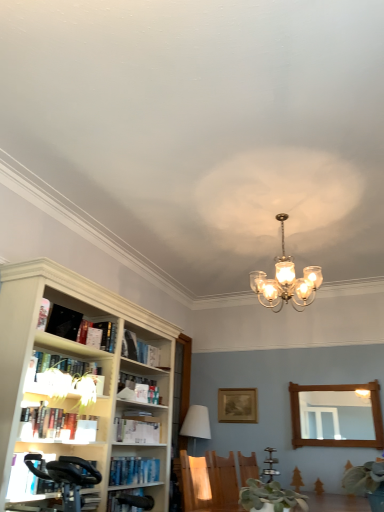
Describe the element at coordinates (101, 334) in the screenshot. This screenshot has height=512, width=384. I see `hardcover book at left, arranged as the seventh book when ordered from the bottom` at that location.

The height and width of the screenshot is (512, 384). What are the coordinates of `wooden mirror at right` in the screenshot? It's located at (336, 416).

At what (x,y) coordinates should I click in order to perform the action: click on white paper book at left, marked as the third book in a bottom-to-top arrangement. Please return your answer as a coordinate pair (x, y). The height and width of the screenshot is (512, 384). Looking at the image, I should click on (137, 431).

Measure the distance between blue hardcover book at lower left, the tenth book when ordered from top to bottom, and camera.

10.93 feet.

You are a GUI agent. You are given a task and a screenshot of the screen. Output one action in this format:
    pyautogui.click(x=<x>, y=<y>)
    Task: Click on the blue hardcover book at lower left, the 1th book when ordered from bottom to top
    Image resolution: width=384 pixels, height=512 pixels.
    Given the screenshot: What is the action you would take?
    pyautogui.click(x=133, y=470)

Measure the distance between point (207, 434) and camera.

They are 4.75 meters apart.

This screenshot has width=384, height=512. I want to click on white fabric lampshade at center, which is the 2th lamp from front to back, so click(196, 424).

What do you see at coordinates (63, 322) in the screenshot? I see `black matte bookshelf at upper left, acting as the second book starting from the top` at bounding box center [63, 322].

The width and height of the screenshot is (384, 512). In order to click on hardcover book at lower left, positioned as the 2th book in bottom-to-top order in this screenshot , I will do `click(75, 501)`.

Locate an element on the screen. The image size is (384, 512). black leather swivel chair at lower left is located at coordinates (67, 477).

The image size is (384, 512). I want to click on hardcover book at left, arranged as the seventh book when ordered from the bottom, so click(101, 334).

Is hardcover book at left, which ranks as the 7th book in top-to-bottom order, positioned beyond the bounds of black matte bookshelf at upper left, the ninth book in the bottom-to-top sequence?

Yes, hardcover book at left, which ranks as the 7th book in top-to-bottom order, is not within black matte bookshelf at upper left, the ninth book in the bottom-to-top sequence.

From the image's perspective, which book is the 5th one above the hardcover book at left, which is the fourth book in bottom-to-top order? Please provide its 2D coordinates.

[(63, 322)]

What's the angular difference between hardcover book at left, which ranks as the 7th book in top-to-bottom order, and black matte bookshelf at upper left, the ninth book in the bottom-to-top sequence,'s facing directions?

There is a 5.68-degree angle between the facing directions of hardcover book at left, which ranks as the 7th book in top-to-bottom order, and black matte bookshelf at upper left, the ninth book in the bottom-to-top sequence.

How much distance is there between hardcover book at left, which ranks as the 7th book in top-to-bottom order, and black matte bookshelf at upper left, the ninth book in the bottom-to-top sequence?

They are 24.04 inches apart.

Considering the relative sizes of hardcover book at left, placed as the 8th book when sorted from bottom to top, and white paper book at left, which is the 8th book in top-to-bottom order, in the image provided, is hardcover book at left, placed as the 8th book when sorted from bottom to top, wider than white paper book at left, which is the 8th book in top-to-bottom order,?

In fact, hardcover book at left, placed as the 8th book when sorted from bottom to top, might be narrower than white paper book at left, which is the 8th book in top-to-bottom order.

Which object is positioned more to the right, hardcover book at left, placed as the 8th book when sorted from bottom to top, or white paper book at left, which is the 8th book in top-to-bottom order?

From the viewer's perspective, white paper book at left, which is the 8th book in top-to-bottom order, appears more on the right side.

Does hardcover book at left, positioned as the 3th book in top-to-bottom order, have a smaller size compared to white paper book at left, marked as the third book in a bottom-to-top arrangement?

Correct, hardcover book at left, positioned as the 3th book in top-to-bottom order, occupies less space than white paper book at left, marked as the third book in a bottom-to-top arrangement.

From the image's perspective, is hardcover book at left, positioned as the 3th book in top-to-bottom order, located above or below white paper book at left, which is the 8th book in top-to-bottom order?

hardcover book at left, positioned as the 3th book in top-to-bottom order, is situated higher than white paper book at left, which is the 8th book in top-to-bottom order, in the image.

Considering the sizes of objects blue hardcover book at lower left, the 1th book when ordered from bottom to top, and black leather swivel chair at lower left in the image provided, who is bigger, blue hardcover book at lower left, the 1th book when ordered from bottom to top, or black leather swivel chair at lower left?

black leather swivel chair at lower left.

Would you say blue hardcover book at lower left, the 1th book when ordered from bottom to top, is inside or outside black leather swivel chair at lower left?

blue hardcover book at lower left, the 1th book when ordered from bottom to top, cannot be found inside black leather swivel chair at lower left.

Is blue hardcover book at lower left, the 1th book when ordered from bottom to top, taller or shorter than black leather swivel chair at lower left?

Clearly, blue hardcover book at lower left, the 1th book when ordered from bottom to top, is shorter compared to black leather swivel chair at lower left.

Which is farther, (53, 333) or (151, 435)?

The point (151, 435) is farther from the camera.

Is the depth of black matte bookshelf at upper left, the ninth book in the bottom-to-top sequence, greater than that of white paper book at left, which is the 8th book in top-to-bottom order?

No, the depth of black matte bookshelf at upper left, the ninth book in the bottom-to-top sequence, is less than that of white paper book at left, which is the 8th book in top-to-bottom order.

Based on the photo, does black matte bookshelf at upper left, acting as the second book starting from the top, have a greater height compared to white paper book at left, marked as the third book in a bottom-to-top arrangement?

Yes, black matte bookshelf at upper left, acting as the second book starting from the top, is taller than white paper book at left, marked as the third book in a bottom-to-top arrangement.

Is white paper book at left, marked as the third book in a bottom-to-top arrangement, located within black matte bookshelf at upper left, acting as the second book starting from the top?

No.

Choose the correct answer: Is hardcover book at left, which is the fourth book in bottom-to-top order, inside hardcover book at center, which is counted as the 5th book, starting from the bottom, or outside it?

hardcover book at left, which is the fourth book in bottom-to-top order, is outside hardcover book at center, which is counted as the 5th book, starting from the bottom.

Looking at this image, from a real-world perspective, is hardcover book at left, which is the fourth book in bottom-to-top order, physically located above or below hardcover book at center, which is counted as the 5th book, starting from the bottom?

From a real-world perspective, hardcover book at left, which is the fourth book in bottom-to-top order, is physically below hardcover book at center, which is counted as the 5th book, starting from the bottom.

Who is bigger, hardcover book at left, which ranks as the 7th book in top-to-bottom order, or hardcover book at center, which is counted as the 5th book, starting from the bottom?

hardcover book at center, which is counted as the 5th book, starting from the bottom.

From a real-world perspective, which is physically below, hardcover book at center, which is counted as the 5th book, starting from the bottom, or white fabric lampshade at center, which appears as the 2th lamp when viewed from the top?

white fabric lampshade at center, which appears as the 2th lamp when viewed from the top, from a real-world perspective.

Is hardcover book at center, which is counted as the 5th book, starting from the bottom, to the right of white fabric lampshade at center, which ranks as the second lamp in right-to-left order, from the viewer's perspective?

Incorrect, hardcover book at center, which is counted as the 5th book, starting from the bottom, is not on the right side of white fabric lampshade at center, which ranks as the second lamp in right-to-left order.

Does hardcover book at center, which is counted as the 5th book, starting from the bottom, have a smaller size compared to white fabric lampshade at center, which ranks as the second lamp in right-to-left order?

Correct, hardcover book at center, which is counted as the 5th book, starting from the bottom, occupies less space than white fabric lampshade at center, which ranks as the second lamp in right-to-left order.

Looking at this image, how far apart are hardcover book at center, which is the sixth book in top-to-bottom order, and white fabric lampshade at center, which ranks as the second lamp in right-to-left order?

hardcover book at center, which is the sixth book in top-to-bottom order, and white fabric lampshade at center, which ranks as the second lamp in right-to-left order, are 1.13 meters apart.

Looking at their sizes, would you say blue hardcover book at lower left, the 1th book when ordered from bottom to top, is wider or thinner than wooden chair at lower center?

Considering their sizes, blue hardcover book at lower left, the 1th book when ordered from bottom to top, looks slimmer than wooden chair at lower center.

From a real-world perspective, who is located lower, blue hardcover book at lower left, the tenth book when ordered from top to bottom, or wooden chair at lower center?

wooden chair at lower center, from a real-world perspective.

At what (x,y) coordinates should I click in order to perform the action: click on armchair above the blue hardcover book at lower left, the 1th book when ordered from bottom to top (from the image's perspective). Please return your answer as a coordinate pair (x, y). The image size is (384, 512). Looking at the image, I should click on (211, 483).

Is wooden chair at lower center inside blue hardcover book at lower left, the tenth book when ordered from top to bottom?

No, wooden chair at lower center is not inside blue hardcover book at lower left, the tenth book when ordered from top to bottom.

Starting from the black matte bookshelf at upper left, the ninth book in the bottom-to-top sequence, which book is the 1st one to the right? Please provide its 2D coordinates.

[(56, 424)]

From the image's perspective, which book is the 5th one below the hardcover book at left, placed as the 8th book when sorted from bottom to top? Please provide its 2D coordinates.

[(137, 431)]

Looking at this image, which object lies nearer to the anchor point black leather swivel chair at lower left, green matte plant at lower center or hardcover book at lower left, positioned as the 2th book in bottom-to-top order?

Among the two, hardcover book at lower left, positioned as the 2th book in bottom-to-top order, is located nearer to black leather swivel chair at lower left.

From the image, which object appears to be farther from hardcover book at lower left, positioned as the 2th book in bottom-to-top order, wooden mirror at right or wooden picture frame at center?

Based on the image, wooden mirror at right appears to be further to hardcover book at lower left, positioned as the 2th book in bottom-to-top order.

Which object lies nearer to the anchor point hardcover book at center, which is the sixth book in top-to-bottom order, hardcover book at lower left, the 9th book from the top, or white paper book at left, placed as the fifth book when sorted from top to bottom?

Based on the image, white paper book at left, placed as the fifth book when sorted from top to bottom, appears to be nearer to hardcover book at center, which is the sixth book in top-to-bottom order.

Considering their positions, is white fabric lampshade at center, which is the 2th lamp from front to back, positioned closer to green matte plant at lower center than wooden picture frame at center?

The object closer to green matte plant at lower center is white fabric lampshade at center, which is the 2th lamp from front to back.

Estimate the real-world distances between objects in this image. Which object is closer to hardcover book at left, which ranks as the 7th book in top-to-bottom order, black matte bookshelf at upper left, acting as the second book starting from the top, or translucent glass chandelier at upper center, the 1th lamp from the right?

black matte bookshelf at upper left, acting as the second book starting from the top, is closer to hardcover book at left, which ranks as the 7th book in top-to-bottom order.

When comparing their distances from wooden chair at lower center, does hardcover book at left, which is the fourth book in bottom-to-top order, or green matte plant at lower center seem further?

Among the two, green matte plant at lower center is located further to wooden chair at lower center.

Considering their positions, is black matte bookshelf at upper left, acting as the second book starting from the top, positioned further to white paper book at left, which is the 6th book in bottom-to-top order, than hardcover book at left, placed as the 8th book when sorted from bottom to top?

Among the two, black matte bookshelf at upper left, acting as the second book starting from the top, is located further to white paper book at left, which is the 6th book in bottom-to-top order.

Considering their positions, is wooden picture frame at center positioned further to hardcover book at left, arranged as the seventh book when ordered from the bottom, than white fabric lampshade at center, which appears as the 2th lamp when viewed from the top?

Among the two, wooden picture frame at center is located further to hardcover book at left, arranged as the seventh book when ordered from the bottom.

The image size is (384, 512). In order to click on armchair that lies between black matte bookshelf at upper left, the ninth book in the bottom-to-top sequence, and blue hardcover book at lower left, the tenth book when ordered from top to bottom, from top to bottom in this screenshot , I will do `click(211, 483)`.

Locate an element on the screen. The image size is (384, 512). armchair located between white paper book at left, which is the 6th book in bottom-to-top order, and wooden mirror at right in the left-right direction is located at coordinates (211, 483).

Image resolution: width=384 pixels, height=512 pixels. In order to click on plant located between white matte bookshelf at upper left, arranged as the tenth book when ordered from the bottom, and translucent glass chandelier at upper center, positioned as the 2th lamp in bottom-to-top order, in the left-right direction in this screenshot , I will do `click(270, 496)`.

Identify the location of swivel chair between green matte plant at lower center and hardcover book at left, arranged as the seventh book when ordered from the bottom, in the front-back direction. (67, 477).